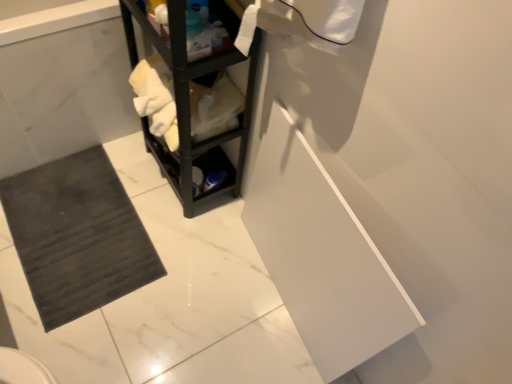
The height and width of the screenshot is (384, 512). What are the coordinates of `blank space to the left of black matte shelf at center` in the screenshot? It's located at (114, 180).